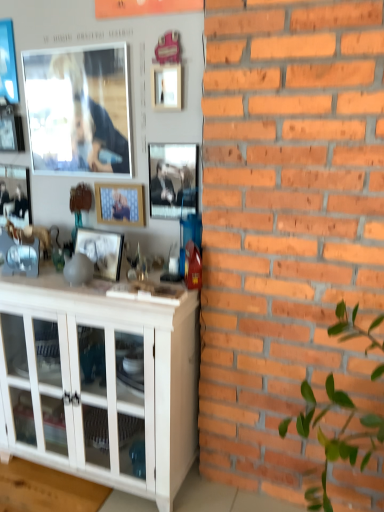
At what (x,y) coordinates should I click in order to perform the action: click on vacant space to the right of matte wooden picture frame at center, marked as the fifth picture frame in a left-to-right arrangement. Please return your answer as a coordinate pair (x, y). The image size is (384, 512). Looking at the image, I should click on (137, 270).